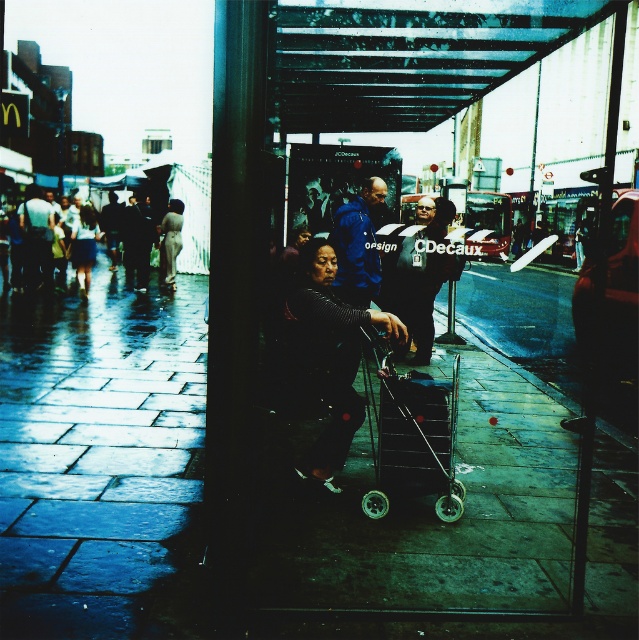
You are a pedestrian trying to cross the street and see the dark gray fabric jacket at center and the dark blue jacket at left. Which person is closer to you?

The dark gray fabric jacket at center is closer to you because it is in front of the dark blue jacket at left.

You are a delivery person needing to place a large package on either the metallic silver cart at center or the dark gray fabric umbrella at center. Which object can you place the package on without it falling off, considering their positions relative to you?

The metallic silver cart at center is closer to the viewer than the dark gray fabric umbrella at center. Since the cart is closer, it is more stable for placing the package, so you should place it on the metallic silver cart at center.